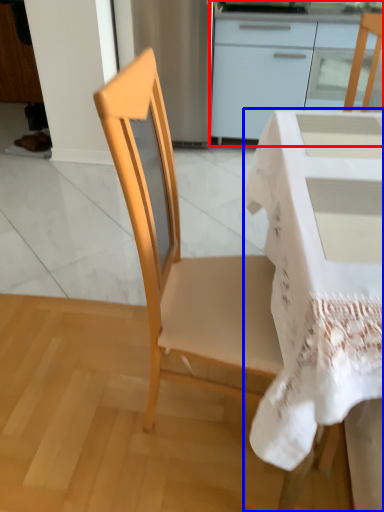
Question: Which object appears farthest to the camera in this image, cabinetry (highlighted by a red box) or desk (highlighted by a blue box)?

Choices:
 (A) cabinetry
 (B) desk

Answer: (A)